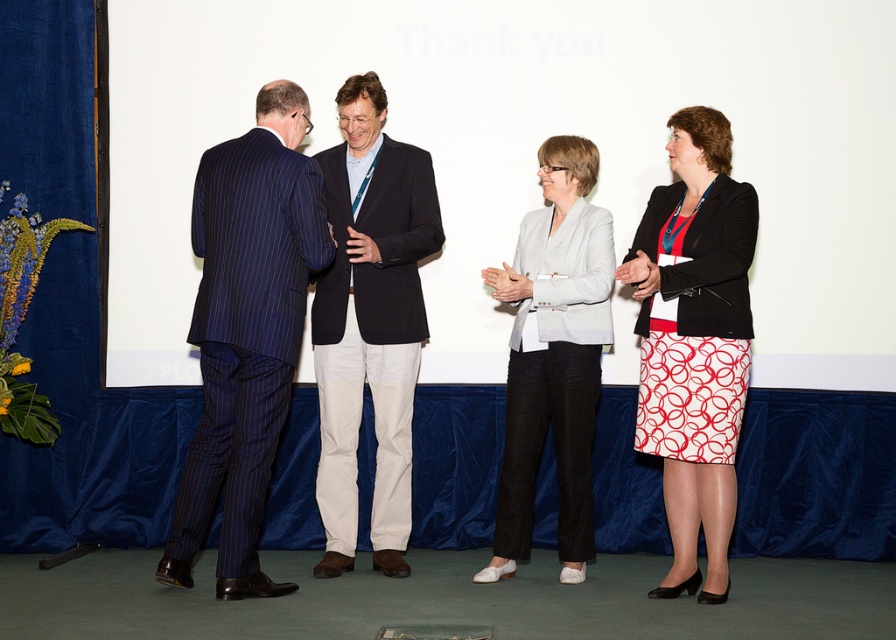
You are attending a conference and want to take a photo of the dark blue pinstripe suit at center without including the white printed skirt at center in the frame. Is this possible given their positions?

The white printed skirt at center is taller than dark blue pinstripe suit at center, so it might be challenging to exclude the white printed skirt at center from the photo if they are positioned close together in height. Adjusting the camera angle or moving closer to the dark blue pinstripe suit at center could help avoid capturing the taller white printed skirt at center.

You are attending a virtual meeting and need to share your screen. The presenter is using a laptop positioned in front of the white printed skirt at center. Can you see the white matte screen at upper center clearly enough to share your screen effectively?

The white matte screen at upper center has a larger size compared to the white printed skirt at center, so yes, you can see the white matte screen at upper center clearly enough to share your screen effectively.

You are attending a virtual meeting and need to focus on the speaker wearing the white printed skirt at center. However, the white matte screen at upper center is distracting you. Which object should you adjust your view to prioritize seeing the speaker clearly?

The white matte screen at upper center is positioned on the left side of the white printed skirt at center. To focus on the speaker wearing the white printed skirt at center, adjust your view to the right side of the screen where the speaker is located, away from the white matte screen at upper center.